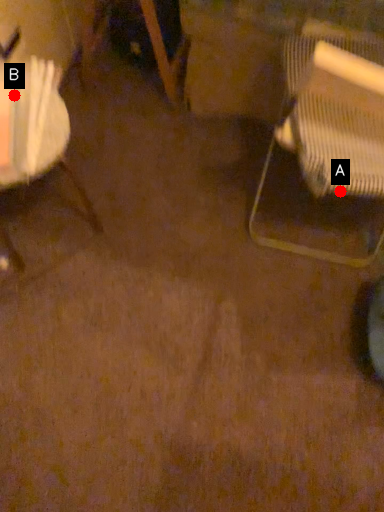
Question: Two points are circled on the image, labeled by A and B beside each circle. Which point is closer to the camera?

Choices:
 (A) A is closer
 (B) B is closer

Answer: (B)